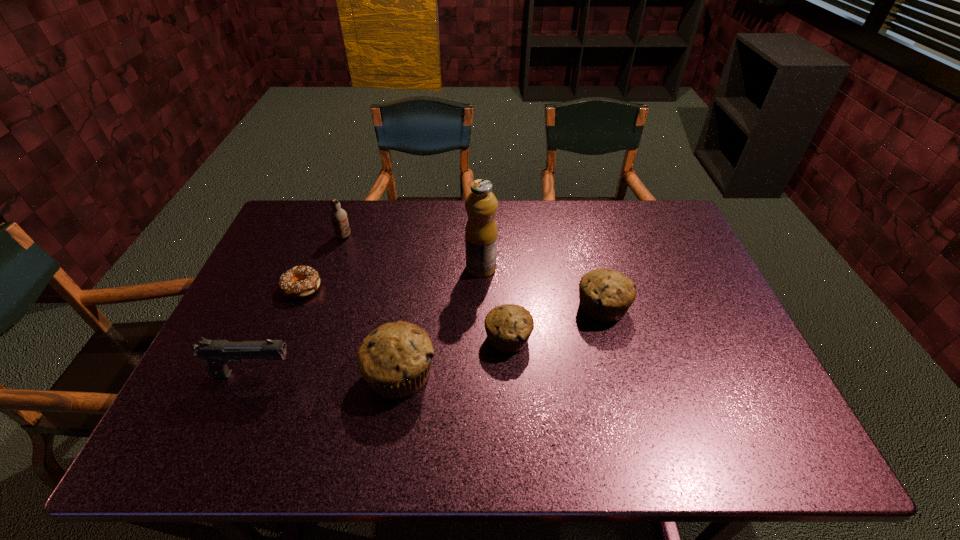
The height and width of the screenshot is (540, 960). What are the coordinates of `gun that is at the near edge` in the screenshot? It's located at (217, 353).

This screenshot has width=960, height=540. I want to click on gun that is at the left edge, so click(x=217, y=353).

This screenshot has height=540, width=960. Find the location of `doughnut situated at the left edge`. doughnut situated at the left edge is located at coordinates (310, 280).

The height and width of the screenshot is (540, 960). Find the location of `object that is positioned at the near left corner`. object that is positioned at the near left corner is located at coordinates (217, 353).

I want to click on blank space at the far edge of the desktop, so click(x=329, y=234).

I want to click on vacant space at the near edge, so click(304, 411).

Identify the location of free space at the left edge. (276, 295).

Where is `vacant space at the right edge of the desktop`? Image resolution: width=960 pixels, height=540 pixels. vacant space at the right edge of the desktop is located at coordinates (670, 283).

This screenshot has width=960, height=540. In order to click on blank area at the near left corner in this screenshot , I will do coord(190,404).

The height and width of the screenshot is (540, 960). Identify the location of blank space at the near right corner. (730, 398).